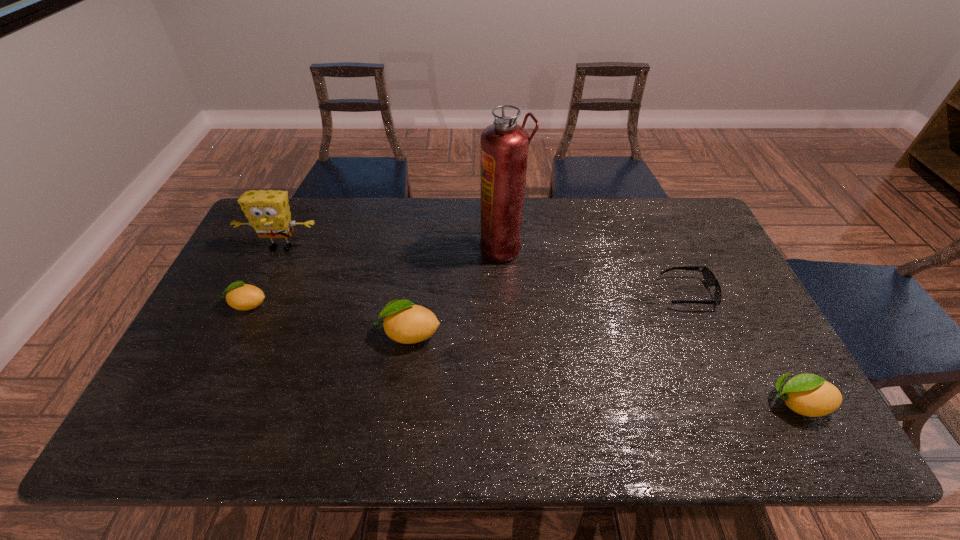
Identify the location of lemon that stands as the closest to the fifth shortest object. The width and height of the screenshot is (960, 540). (241, 296).

The height and width of the screenshot is (540, 960). I want to click on free space that satisfies the following two spatial constraints: 1. on the face of the second tallest object; 2. with leaves positioned above the leftmost lemon, so click(255, 304).

Identify the location of free space in the image that satisfies the following two spatial constraints: 1. on the face of the second tallest object; 2. with leaves positioned above the farthest lemon. (255, 304).